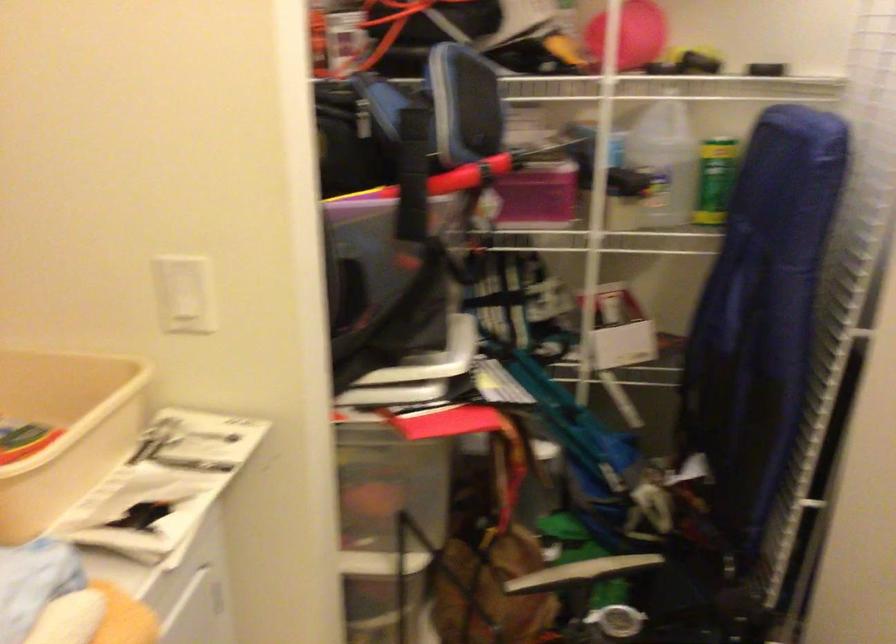
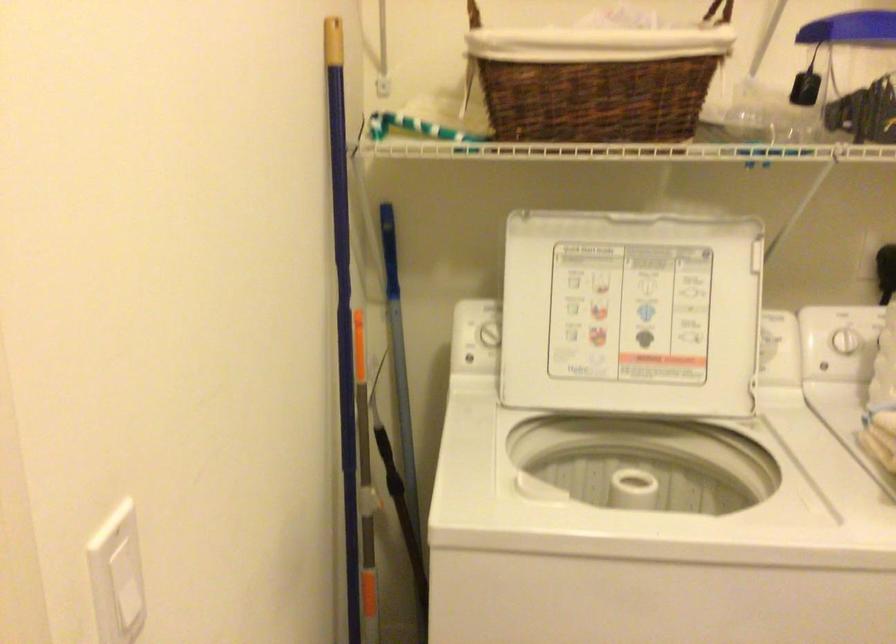
How did the camera likely rotate?

The camera's rotation is toward left-down.